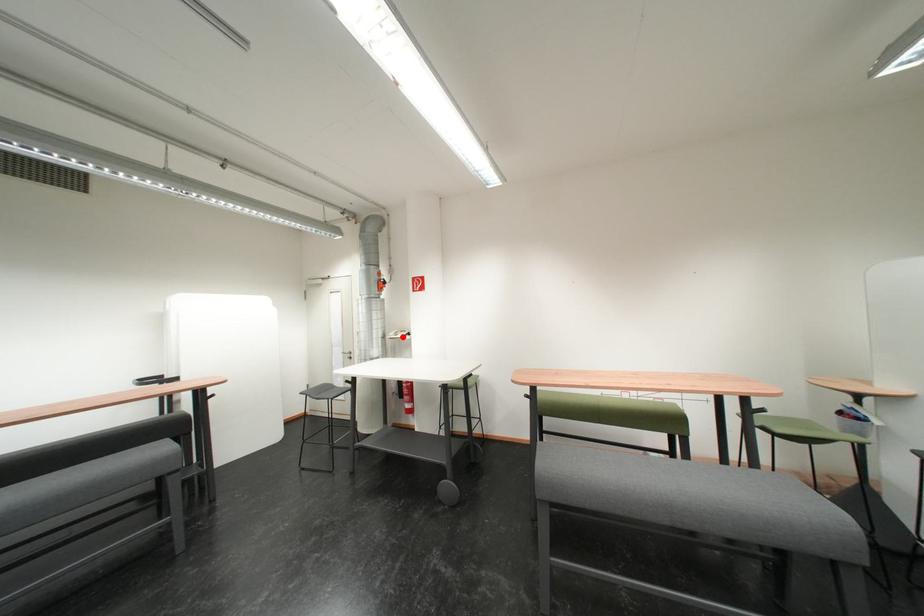
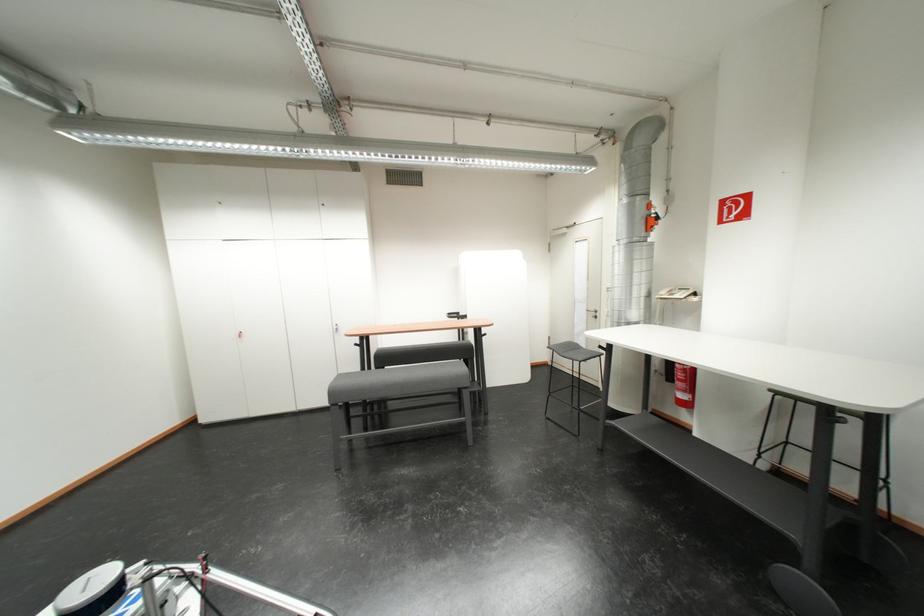
Locate, in the second image, the point that corresponds to the highlighted location in the first image.

(675, 296)